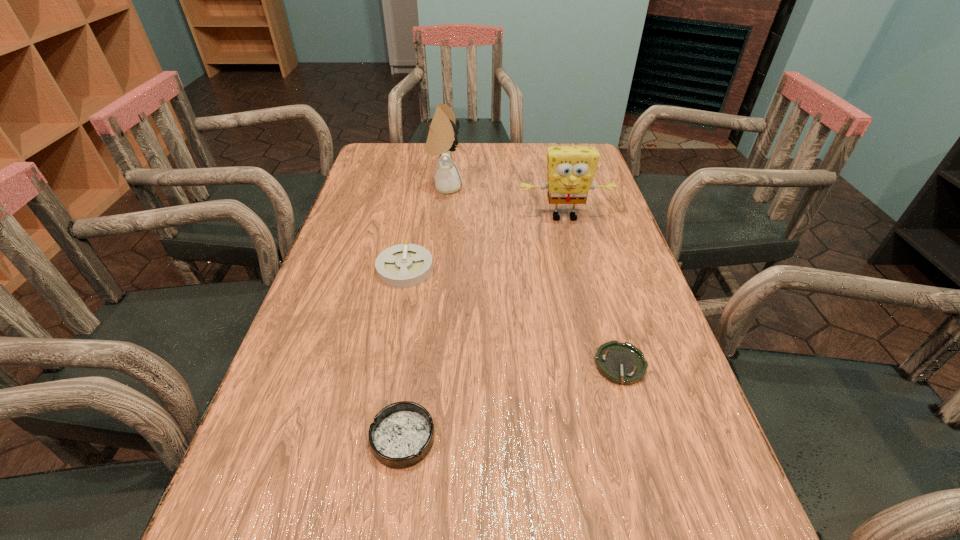
Locate an element on the screen. This screenshot has width=960, height=540. free space located 0.290m at the front face of the tallest object is located at coordinates (560, 187).

Where is `vacant space located on the face of the sponge`? vacant space located on the face of the sponge is located at coordinates (573, 253).

Where is `vacant point located 0.090m on the right of the farthest ashtray`? vacant point located 0.090m on the right of the farthest ashtray is located at coordinates (470, 269).

At what (x,y) coordinates should I click in order to perform the action: click on vacant region located on the back of the second shortest object. Please return your answer as a coordinate pair (x, y). This screenshot has height=540, width=960. Looking at the image, I should click on (421, 304).

The width and height of the screenshot is (960, 540). I want to click on vacant space located 0.110m on the front of the fourth farthest object, so click(644, 446).

You are a GUI agent. You are given a task and a screenshot of the screen. Output one action in this format:
    pyautogui.click(x=<x>, y=<y>)
    Task: Click on the object located in the far edge section of the desktop
    
    Given the screenshot: What is the action you would take?
    pyautogui.click(x=442, y=138)

The width and height of the screenshot is (960, 540). What are the coordinates of `object that is positioned at the left edge` in the screenshot? It's located at (404, 265).

Locate an element on the screen. This screenshot has width=960, height=540. sponge that is at the right edge is located at coordinates (571, 169).

This screenshot has width=960, height=540. Identify the location of ashtray that is at the right edge. (621, 363).

The image size is (960, 540). In order to click on vacant position at the far edge of the desktop in this screenshot , I will do `click(536, 158)`.